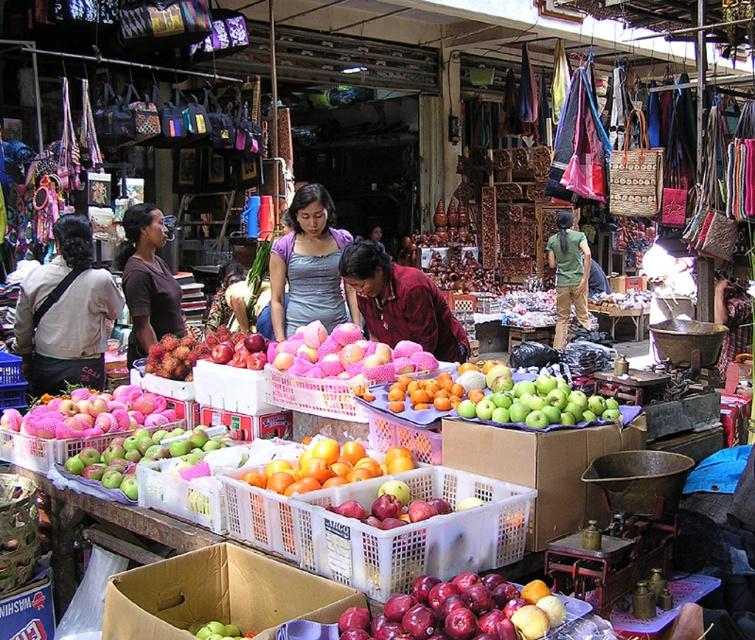
Question: Can you confirm if green cardboard box at center is smaller than purple matte shirt at center?

Choices:
 (A) no
 (B) yes

Answer: (B)

Question: Is cardboard box filled with apples at center positioned behind brown fabric shirt at center?

Choices:
 (A) no
 (B) yes

Answer: (A)

Question: Which point is closer to the camera taking this photo?

Choices:
 (A) (424, 404)
 (B) (116, 602)

Answer: (B)

Question: Does purple matte shirt at center appear over green cotton shirt at center?

Choices:
 (A) no
 (B) yes

Answer: (A)

Question: Which point is closer to the camera?

Choices:
 (A) (134, 353)
 (B) (251, 625)
 (C) (220, 342)

Answer: (B)

Question: Which point is farther to the camera?

Choices:
 (A) green matte apples at center
 (B) matte black shirt at left
 (C) green cardboard box at center

Answer: (B)